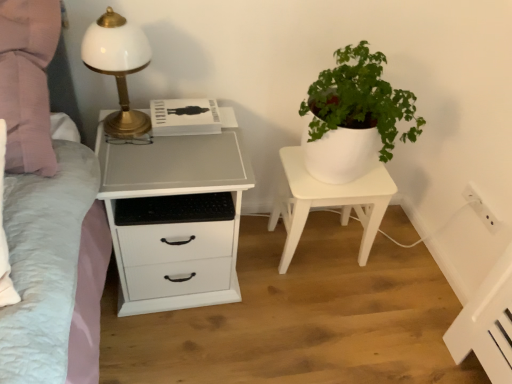
Question: Is white matte chest of drawers at left wider or thinner than white glossy table lamp at left?

Choices:
 (A) wide
 (B) thin

Answer: (A)

Question: From the image's perspective, is white matte chest of drawers at left above or below white glossy table lamp at left?

Choices:
 (A) above
 (B) below

Answer: (B)

Question: Which object is positioned farthest from the white plastic electric outlet at upper right?

Choices:
 (A) white matte chest of drawers at left
 (B) white glossy table lamp at left
 (C) white matte plant pot at center

Answer: (B)

Question: Which is farther from the white glossy table lamp at left?

Choices:
 (A) white plastic electric outlet at upper right
 (B) white matte plant pot at center
 (C) white matte chest of drawers at left

Answer: (A)